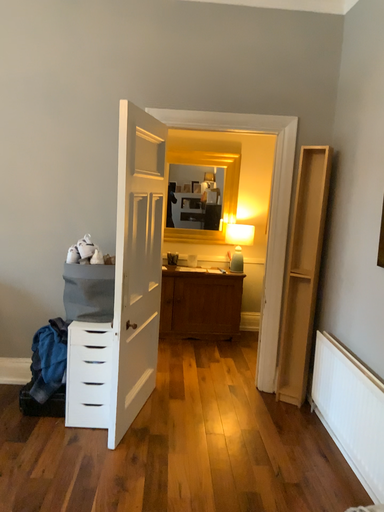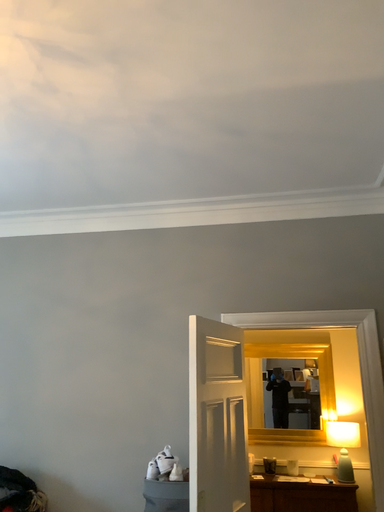
Question: How did the camera likely rotate when shooting the video?

Choices:
 (A) rotated downward
 (B) rotated upward

Answer: (B)